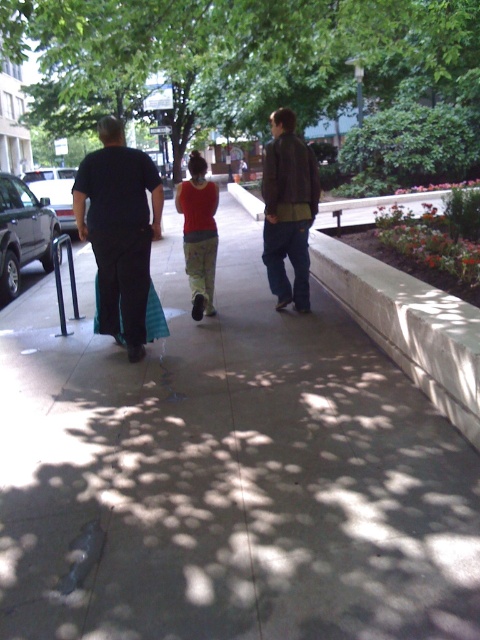
Question: Which object is positioned closest to the red cotton shirt at center?

Choices:
 (A) white concrete curb at center
 (B) gray concrete sidewalk at center

Answer: (B)

Question: Observing the image, what is the correct spatial positioning of green leafy tree at upper center in reference to dark blue t-shirt at center?

Choices:
 (A) left
 (B) right

Answer: (A)

Question: Is dark blue t-shirt at center smaller than red cotton shirt at center?

Choices:
 (A) no
 (B) yes

Answer: (B)

Question: Considering the relative positions of gray concrete sidewalk at center and leather jacket at center in the image provided, where is gray concrete sidewalk at center located with respect to leather jacket at center?

Choices:
 (A) above
 (B) below

Answer: (B)

Question: Considering the real-world distances, which object is farthest from the dark gray pants at center?

Choices:
 (A) red cotton shirt at center
 (B) dark blue t-shirt at center

Answer: (A)

Question: Considering the real-world distances, which object is closest to the leather jacket at center?

Choices:
 (A) white concrete curb at center
 (B) dark gray pants at center
 (C) green leafy tree at upper center

Answer: (B)